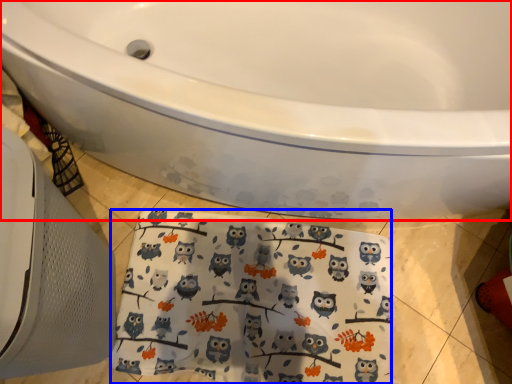
Question: Which of the following is the farthest to the observer, bathtub (highlighted by a red box) or beach towel (highlighted by a blue box)?

Choices:
 (A) bathtub
 (B) beach towel

Answer: (B)